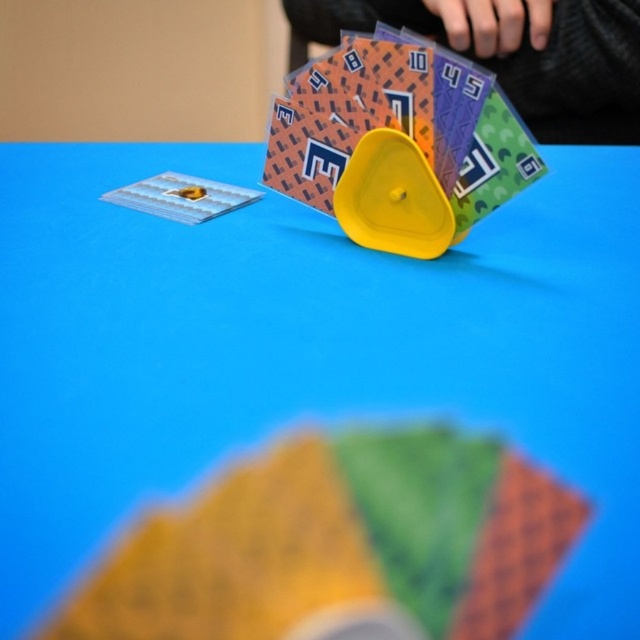
Question: Which of the following is the closest to the observer?

Choices:
 (A) (260, 600)
 (B) (355, 70)

Answer: (A)

Question: From the image, what is the correct spatial relationship of matte plastic cards at center in relation to yellow plastic triangle at center?

Choices:
 (A) right
 (B) left

Answer: (B)

Question: Is matte plastic cards at center wider than yellow plastic triangle at center?

Choices:
 (A) no
 (B) yes

Answer: (A)

Question: Among these objects, which one is farthest from the camera?

Choices:
 (A) yellow plastic triangle at center
 (B) matte plastic cards at center

Answer: (A)

Question: Is matte plastic cards at center wider than yellow plastic triangle at center?

Choices:
 (A) no
 (B) yes

Answer: (A)